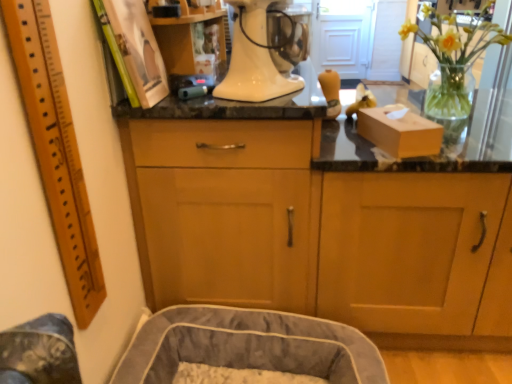
Question: Can you confirm if wooden ruler at left is positioned to the left of white glossy stand mixer at center?

Choices:
 (A) no
 (B) yes

Answer: (B)

Question: Is wooden ruler at left to the right of white glossy stand mixer at center from the viewer's perspective?

Choices:
 (A) yes
 (B) no

Answer: (B)

Question: Does wooden ruler at left come in front of white glossy stand mixer at center?

Choices:
 (A) yes
 (B) no

Answer: (A)

Question: Is wooden ruler at left smaller than white glossy stand mixer at center?

Choices:
 (A) no
 (B) yes

Answer: (B)

Question: Is wooden ruler at left further to the viewer compared to white glossy stand mixer at center?

Choices:
 (A) yes
 (B) no

Answer: (B)

Question: Relative to soft gray fabric dog bed at lower left, is wooden cabinet at center, placed as the 1th cabinetry when sorted from left to right, in front or behind?

Choices:
 (A) front
 (B) behind

Answer: (B)

Question: Considering the positions of point (238, 226) and point (231, 319), is point (238, 226) closer or farther from the camera than point (231, 319)?

Choices:
 (A) closer
 (B) farther

Answer: (A)

Question: Is wooden cabinet at center, placed as the 1th cabinetry when sorted from left to right, spatially inside soft gray fabric dog bed at lower left, or outside of it?

Choices:
 (A) inside
 (B) outside

Answer: (B)

Question: In terms of width, does wooden cabinet at center, acting as the 2th cabinetry starting from the right, look wider or thinner when compared to soft gray fabric dog bed at lower left?

Choices:
 (A) wide
 (B) thin

Answer: (A)

Question: Is matte cardboard box at right taller or shorter than white glossy stand mixer at center?

Choices:
 (A) tall
 (B) short

Answer: (B)

Question: From a real-world perspective, is matte cardboard box at right positioned above or below white glossy stand mixer at center?

Choices:
 (A) above
 (B) below

Answer: (B)

Question: In the image, is matte cardboard box at right positioned in front of or behind white glossy stand mixer at center?

Choices:
 (A) behind
 (B) front

Answer: (A)

Question: Based on their positions, is matte cardboard box at right located to the left or right of white glossy stand mixer at center?

Choices:
 (A) left
 (B) right

Answer: (B)

Question: From the image's perspective, relative to wooden cabinet at center, acting as the first cabinetry starting from the right, is soft gray fabric dog bed at lower left above or below?

Choices:
 (A) above
 (B) below

Answer: (B)

Question: Looking at their shapes, would you say soft gray fabric dog bed at lower left is wider or thinner than wooden cabinet at center, acting as the first cabinetry starting from the right?

Choices:
 (A) thin
 (B) wide

Answer: (A)